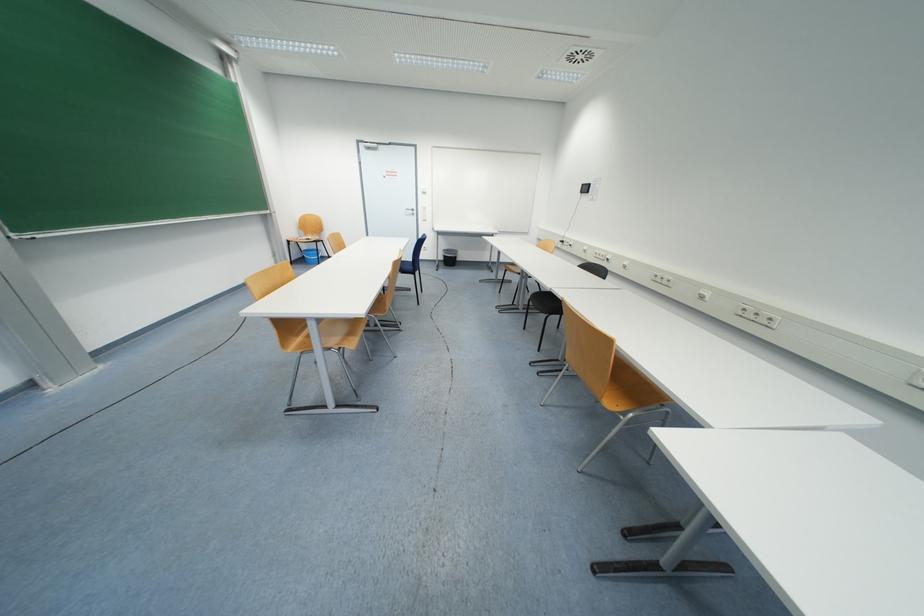
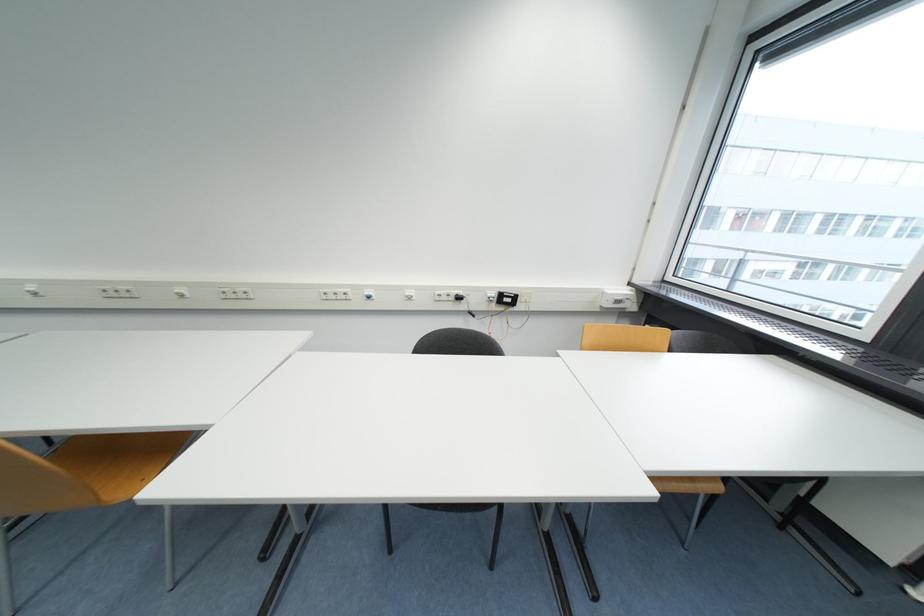
From the picture: Based on the continuous images, in which direction is the camera rotating?

The camera rotated toward right-down.